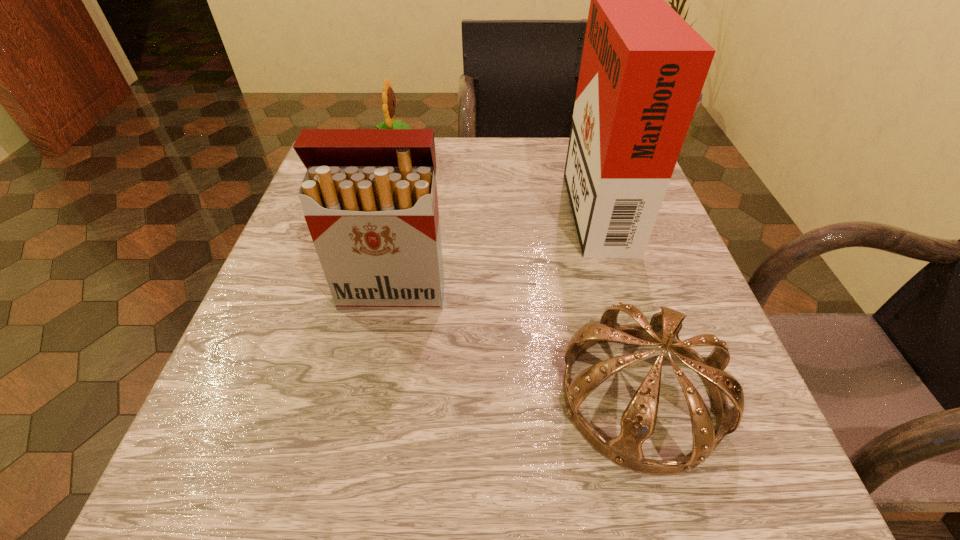
Locate an element on the screen. The image size is (960, 540). the right cigarette case is located at coordinates (643, 67).

At what (x,y) coordinates should I click in order to perform the action: click on the farther cigarette case. Please return your answer as a coordinate pair (x, y). This screenshot has width=960, height=540. Looking at the image, I should click on (643, 67).

Identify the location of the left cigarette case. The width and height of the screenshot is (960, 540). (369, 196).

Where is `the second nearest object`? Image resolution: width=960 pixels, height=540 pixels. the second nearest object is located at coordinates coord(369,196).

Identify the location of sunflower. (388, 97).

The height and width of the screenshot is (540, 960). I want to click on tiara, so click(x=638, y=421).

This screenshot has width=960, height=540. In order to click on the shortest object in this screenshot , I will do `click(638, 421)`.

You are a GUI agent. You are given a task and a screenshot of the screen. Output one action in this format:
    pyautogui.click(x=<x>, y=<y>)
    Task: Click on the vacant space positioned 0.380m on the front-facing side of the taller cigarette case
    This screenshot has width=960, height=540.
    Given the screenshot: What is the action you would take?
    pos(386,202)

You are a GUI agent. You are given a task and a screenshot of the screen. Output one action in this format:
    pyautogui.click(x=<x>, y=<y>)
    Task: Click on the vacant region located on the front-facing side of the taller cigarette case
    
    Given the screenshot: What is the action you would take?
    pyautogui.click(x=531, y=202)

Identify the location of free location located 0.270m on the front-facing side of the taller cigarette case. This screenshot has height=540, width=960. (440, 202).